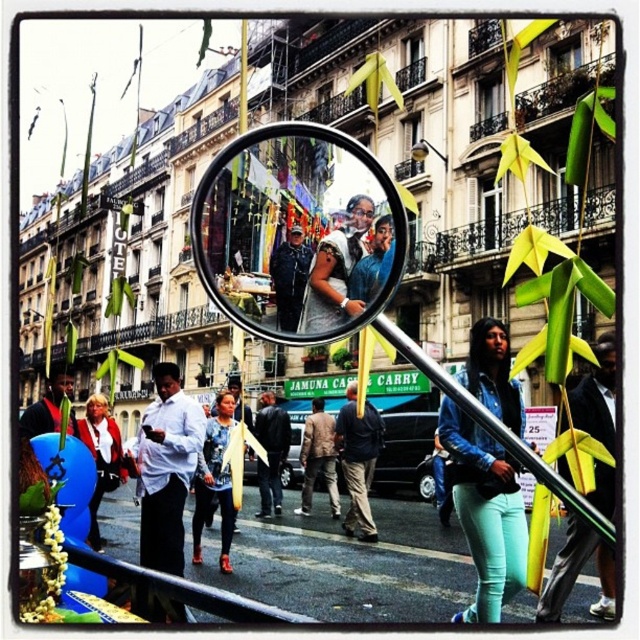
Is transparent plastic magnifying glass at center positioned before denim jacket at lower right?

Yes, it is.

In the scene shown: Between transparent plastic magnifying glass at center and denim jacket at lower right, which one has less height?

Standing shorter between the two is transparent plastic magnifying glass at center.

Describe the element at coordinates (294, 227) in the screenshot. Image resolution: width=640 pixels, height=640 pixels. I see `transparent plastic magnifying glass at center` at that location.

At what (x,y) coordinates should I click in order to perform the action: click on transparent plastic magnifying glass at center. Please return your answer as a coordinate pair (x, y). Looking at the image, I should click on (294, 227).

Can you confirm if transparent plastic magnifying glass at center is positioned below matte black jacket at center?

Actually, transparent plastic magnifying glass at center is above matte black jacket at center.

Who is more forward, (337, 140) or (221, 417)?

Point (337, 140) is more forward.

Locate an element on the screen. transparent plastic magnifying glass at center is located at coordinates (294, 227).

Does denim jacket at lower right have a smaller size compared to white shirt at center?

Yes, denim jacket at lower right is smaller than white shirt at center.

Is denim jacket at lower right shorter than white shirt at center?

In fact, denim jacket at lower right may be taller than white shirt at center.

Where is `denim jacket at lower right`? This screenshot has width=640, height=640. denim jacket at lower right is located at coordinates (484, 512).